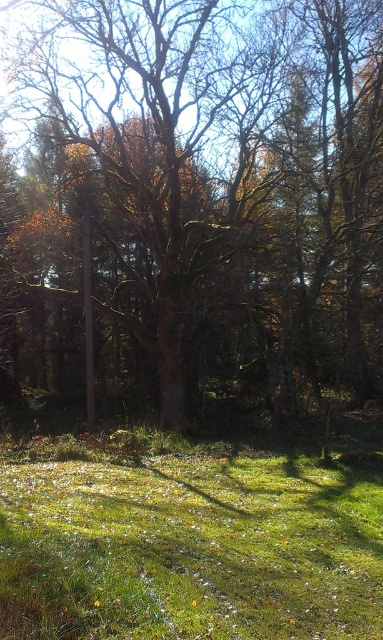
Question: Is brown rough tree at center to the left of green grassy at lower center from the viewer's perspective?

Choices:
 (A) yes
 (B) no

Answer: (B)

Question: Among these points, which one is farthest from the camera?

Choices:
 (A) (70, 618)
 (B) (162, 113)

Answer: (B)

Question: Among these objects, which one is nearest to the camera?

Choices:
 (A) brown rough tree at center
 (B) green grassy at lower center

Answer: (B)

Question: Which point is closer to the camera?

Choices:
 (A) green grassy at lower center
 (B) brown rough tree at center

Answer: (A)

Question: Is brown rough tree at center bigger than green grassy at lower center?

Choices:
 (A) no
 (B) yes

Answer: (B)

Question: From the image, what is the correct spatial relationship of brown rough tree at center in relation to green grassy at lower center?

Choices:
 (A) right
 (B) left

Answer: (A)